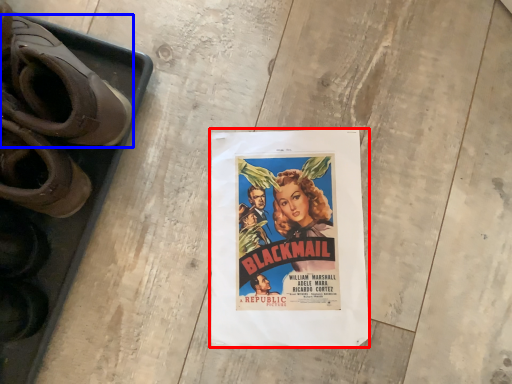
Question: Which point is closer to the camera, poster (highlighted by a red box) or footwear (highlighted by a blue box)?

Choices:
 (A) poster
 (B) footwear

Answer: (B)